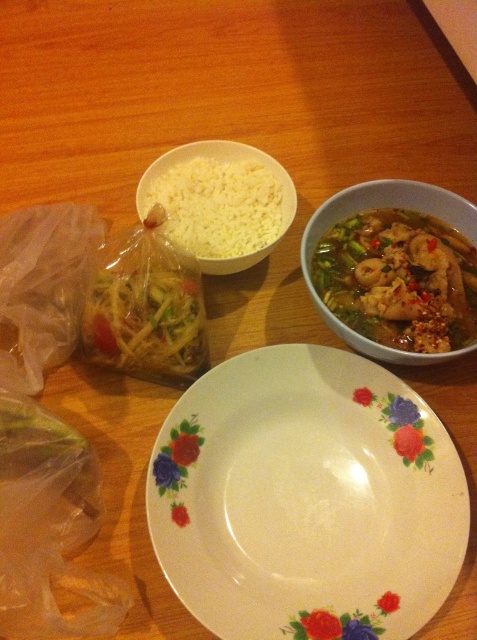
Question: Which of these objects is positioned farthest from the semi-translucent ceramic bowl at upper right?

Choices:
 (A) slightly translucent plastic bag at center-left
 (B) white matte bowl at upper center

Answer: (A)

Question: Does white ceramic plate at center appear over white matte bowl at upper center?

Choices:
 (A) yes
 (B) no

Answer: (B)

Question: Where is white ceramic plate at center located in relation to white matte bowl at upper center in the image?

Choices:
 (A) above
 (B) below

Answer: (B)

Question: Among these objects, which one is nearest to the camera?

Choices:
 (A) semi-translucent ceramic bowl at upper right
 (B) white matte bowl at upper center
 (C) slightly translucent plastic bag at center-left

Answer: (A)

Question: Is white matte bowl at upper center above semi-translucent ceramic bowl at upper right?

Choices:
 (A) yes
 (B) no

Answer: (A)

Question: Estimate the real-world distances between objects in this image. Which object is closer to the semi-translucent ceramic bowl at upper right?

Choices:
 (A) slightly translucent plastic bag at center-left
 (B) white matte bowl at upper center
 (C) white ceramic plate at center

Answer: (B)